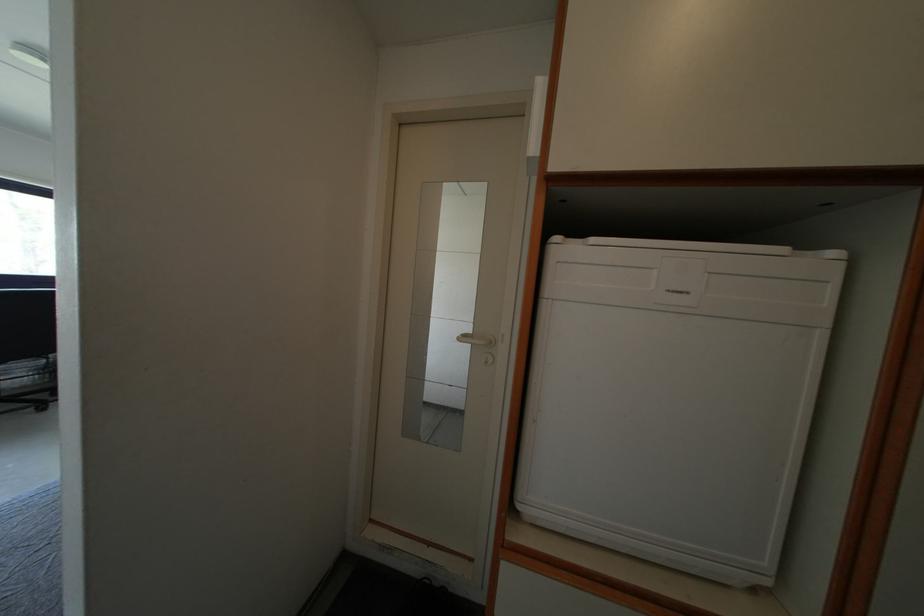
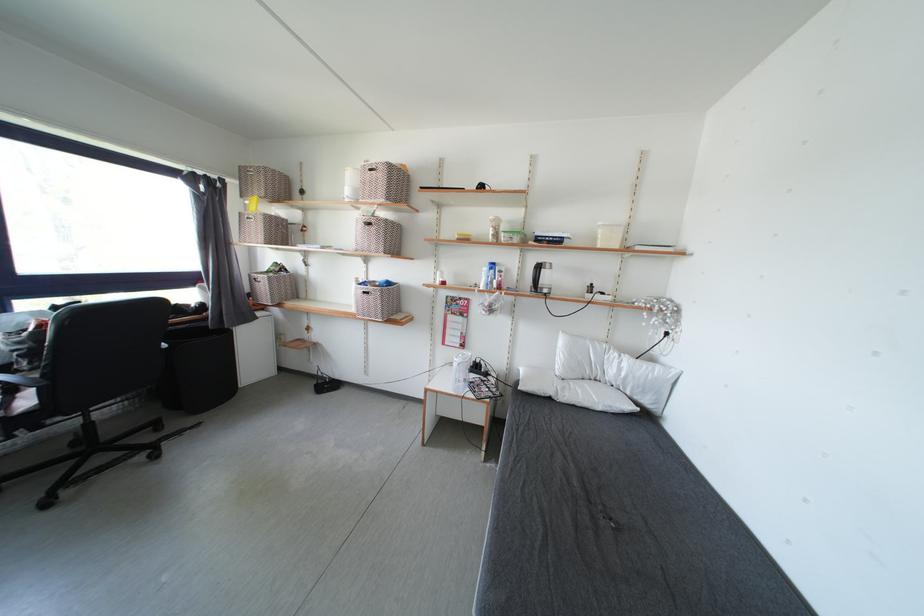
What movement of the cameraman would produce the second image?

The cameraman moved toward left, forward.